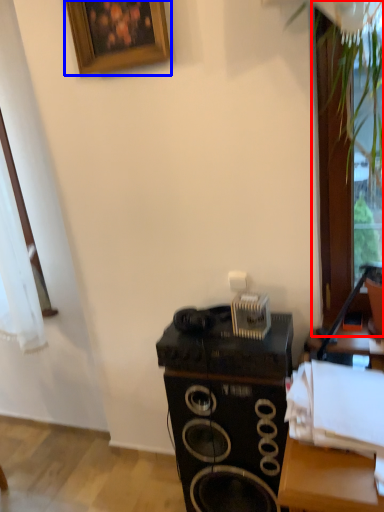
Question: Among these objects, which one is farthest to the camera, glass door (highlighted by a red box) or picture frame (highlighted by a blue box)?

Choices:
 (A) glass door
 (B) picture frame

Answer: (B)